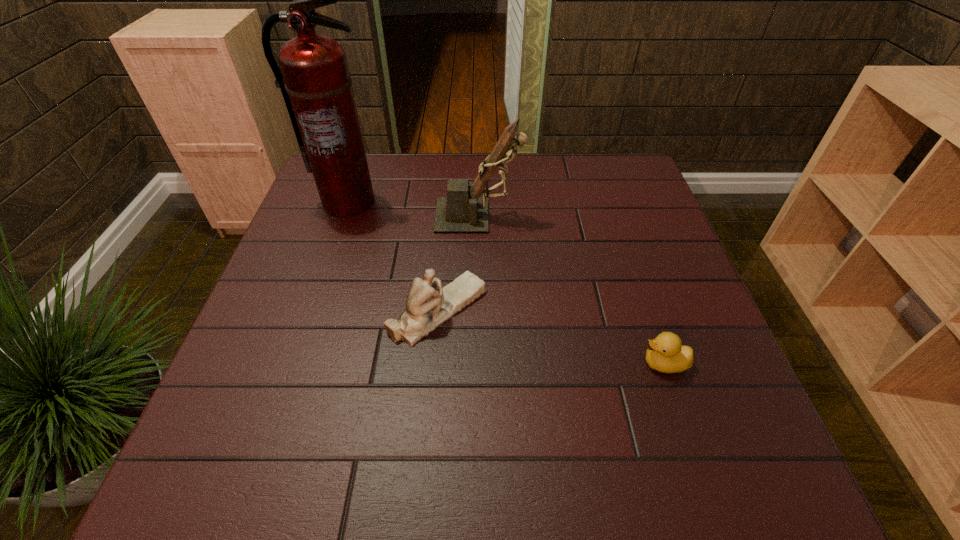
Locate an element on the screen. This screenshot has width=960, height=540. vacant region at the left edge of the desktop is located at coordinates (317, 330).

In the image, there is a desktop. Where is `vacant space at the far left corner`? vacant space at the far left corner is located at coordinates (373, 156).

At what (x,y) coordinates should I click in order to perform the action: click on vacant region at the near right corner of the desktop. Please return your answer as a coordinate pair (x, y). This screenshot has height=540, width=960. Looking at the image, I should click on (700, 479).

At what (x,y) coordinates should I click in order to perform the action: click on vacant area that lies between the leftmost object and the second shortest object. Please return your answer as a coordinate pair (x, y). This screenshot has height=540, width=960. Looking at the image, I should click on (394, 255).

The height and width of the screenshot is (540, 960). What are the coordinates of `free space between the rightmost object and the fire extinguisher` in the screenshot? It's located at (506, 282).

Where is `vacant point located between the tallest object and the second tallest object`? This screenshot has width=960, height=540. vacant point located between the tallest object and the second tallest object is located at coordinates (413, 208).

Locate an element on the screen. unoccupied position between the duckling and the leftmost object is located at coordinates (506, 282).

Where is `free space between the fire extinguisher and the duckling`? free space between the fire extinguisher and the duckling is located at coordinates (506, 282).

Where is `vacant region between the shortest object and the third tallest object`? vacant region between the shortest object and the third tallest object is located at coordinates (551, 336).

Where is `vacant region between the second nearest object and the second tallest object`? The height and width of the screenshot is (540, 960). vacant region between the second nearest object and the second tallest object is located at coordinates (459, 262).